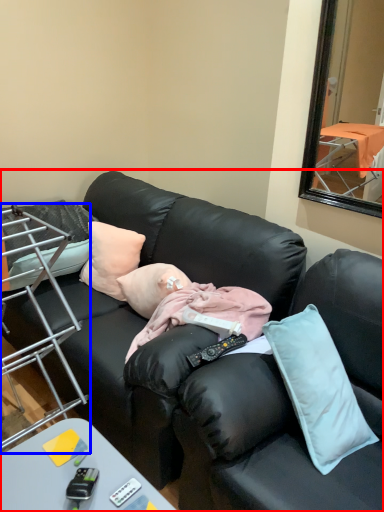
Question: Among these objects, which one is farthest to the camera, studio couch (highlighted by a red box) or chair (highlighted by a blue box)?

Choices:
 (A) studio couch
 (B) chair

Answer: (A)